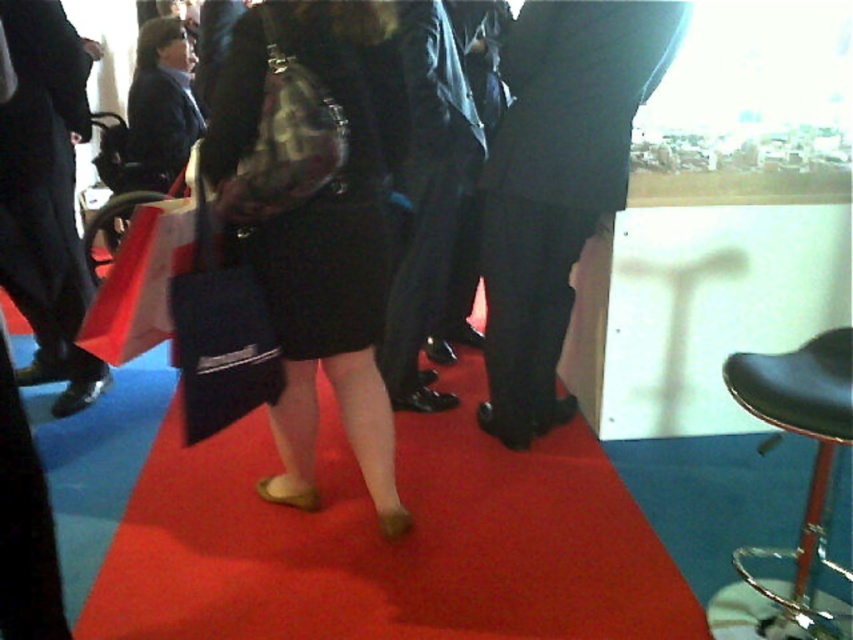
Question: Among these points, which one is farthest from the camera?

Choices:
 (A) (61, 120)
 (B) (839, 369)

Answer: (A)

Question: Which of these objects is positioned closest to the red carpet at center?

Choices:
 (A) black leather stool at lower right
 (B) black leather pants at center
 (C) matte black skirt at center
 (D) matte black dress at center

Answer: (C)

Question: Observing the image, what is the correct spatial positioning of matte black dress at center in reference to black leather stool at lower right?

Choices:
 (A) below
 (B) above

Answer: (B)

Question: Which object is positioned closest to the matte black dress at center?

Choices:
 (A) black leather stool at lower right
 (B) red carpet at center

Answer: (B)

Question: Is matte black dress at center positioned behind black leather stool at lower right?

Choices:
 (A) no
 (B) yes

Answer: (B)

Question: Does red carpet at center lie behind matte black skirt at center?

Choices:
 (A) no
 (B) yes

Answer: (B)